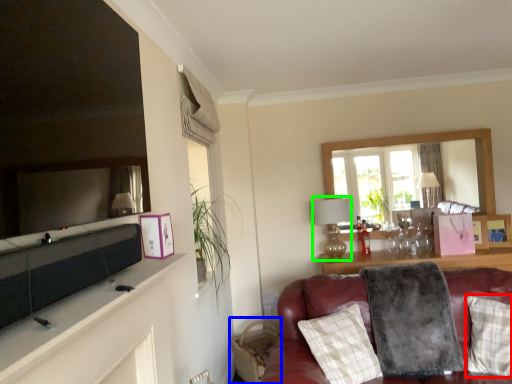
Question: Which object is the closest to the pillow (highlighted by a red box)? Choose among these: swivel chair (highlighted by a blue box) or lamp (highlighted by a green box).

Choices:
 (A) swivel chair
 (B) lamp

Answer: (B)